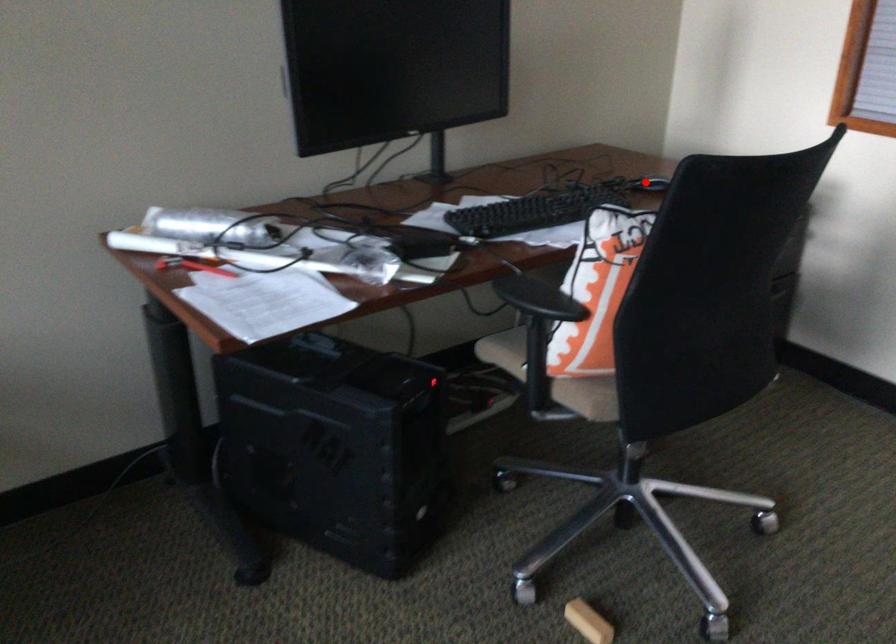
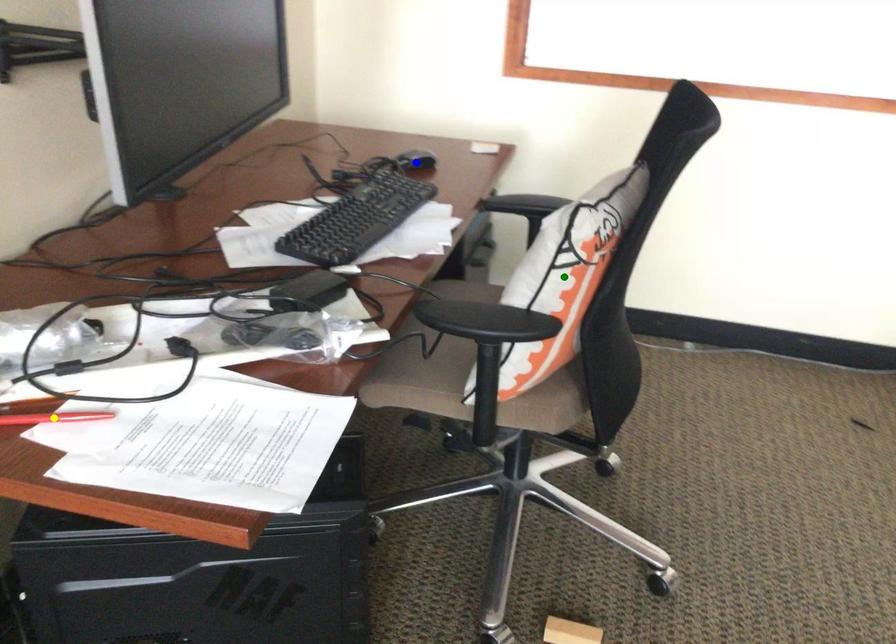
Question: I am providing you with two images of the same scene from different viewpoints. A red point is marked on the first image. You are given multiple points on the second image. Which point in image 2 represents the same 3d spot as the red point in image 1?

Choices:
 (A) blue point
 (B) yellow point
 (C) green point

Answer: (A)